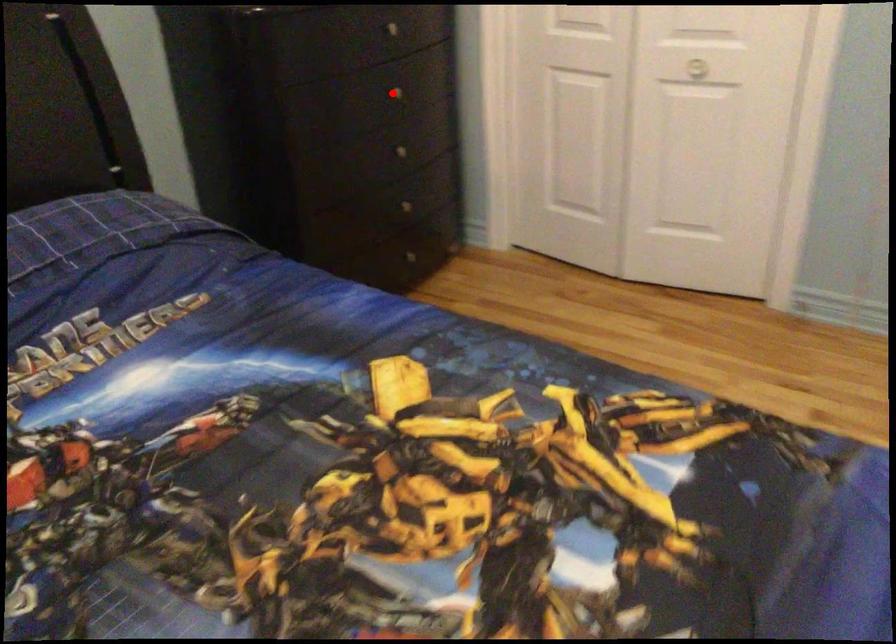
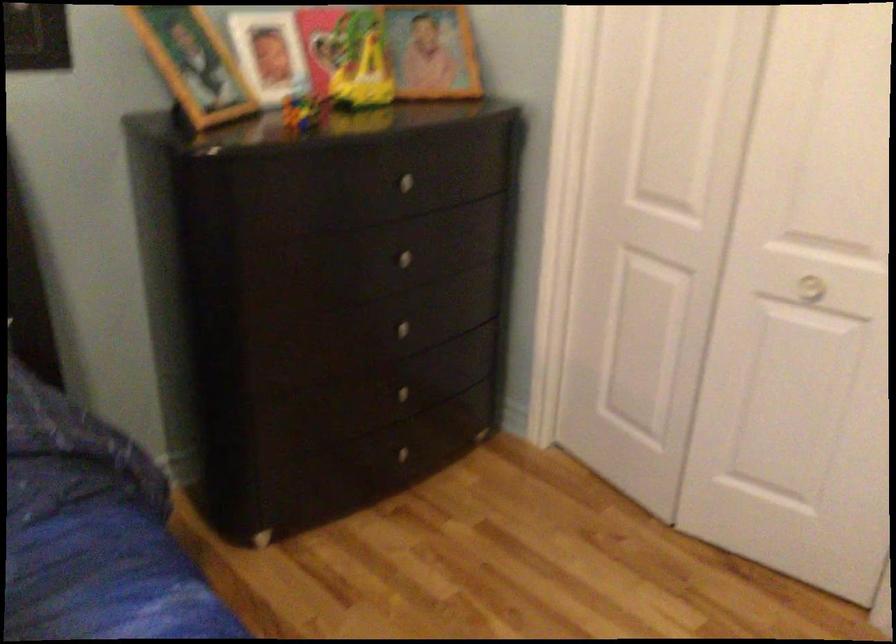
In the second image, find the point that corresponds to the highlighted location in the first image.

(399, 258)